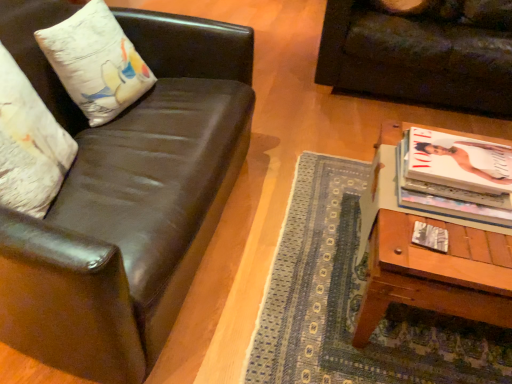
You are a GUI agent. You are given a task and a screenshot of the screen. Output one action in this format:
    pyautogui.click(x=<x>, y=<y>)
    Task: Click on the free spot in front of matte white magazine at right
    This screenshot has width=512, height=384.
    Given the screenshot: What is the action you would take?
    pyautogui.click(x=442, y=269)